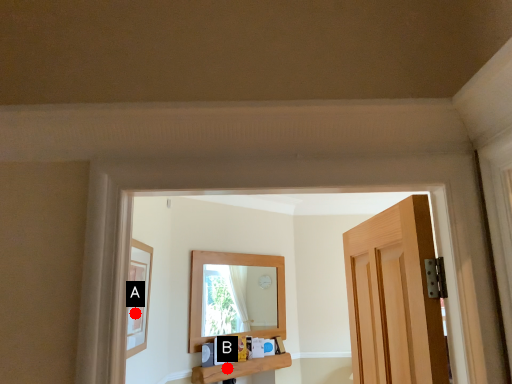
Question: Two points are circled on the image, labeled by A and B beside each circle. Which point is farther from the camera taking this photo?

Choices:
 (A) A is further
 (B) B is further

Answer: (B)